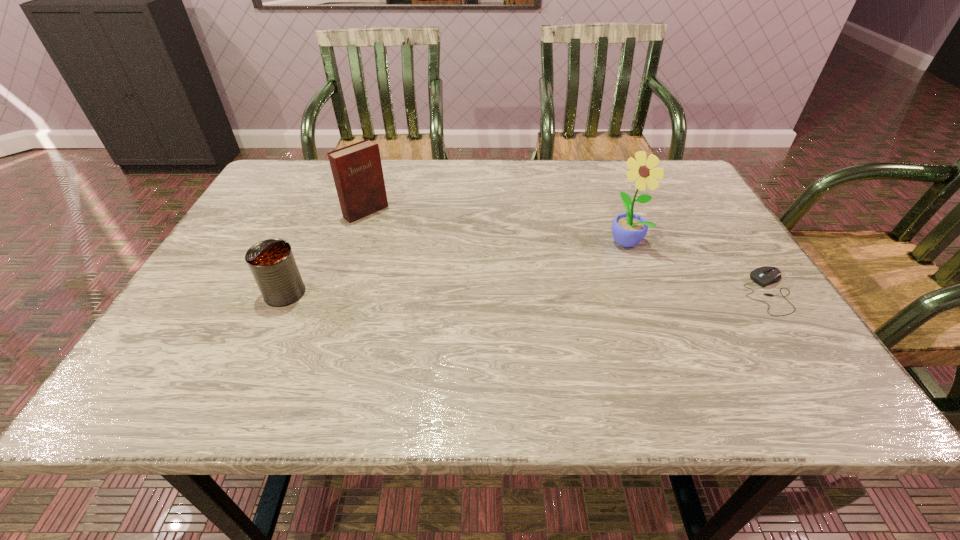
Identify the location of blank space at the near edge of the desktop. The image size is (960, 540). (564, 346).

The width and height of the screenshot is (960, 540). Find the location of `free space at the left edge`. free space at the left edge is located at coordinates (236, 263).

The width and height of the screenshot is (960, 540). I want to click on vacant area at the right edge, so click(677, 213).

Locate an element on the screen. The height and width of the screenshot is (540, 960). free region at the far left corner of the desktop is located at coordinates (293, 163).

Where is `vacant space at the near left corner of the desktop`? The width and height of the screenshot is (960, 540). vacant space at the near left corner of the desktop is located at coordinates (174, 348).

In the image, there is a desktop. In order to click on vacant space at the far right corner in this screenshot , I will do `click(660, 200)`.

The width and height of the screenshot is (960, 540). I want to click on free space between the diary and the can, so click(x=325, y=252).

You are a GUI agent. You are given a task and a screenshot of the screen. Output one action in this format:
    pyautogui.click(x=<x>, y=<y>)
    Task: Click on the free space between the rightmost object and the farthest object
    The height and width of the screenshot is (540, 960).
    Given the screenshot: What is the action you would take?
    pyautogui.click(x=567, y=252)

Where is `free spot between the third object from right to left and the tallest object`? free spot between the third object from right to left and the tallest object is located at coordinates (495, 226).

Identify the location of empty space between the shortest object and the second farthest object. (696, 267).